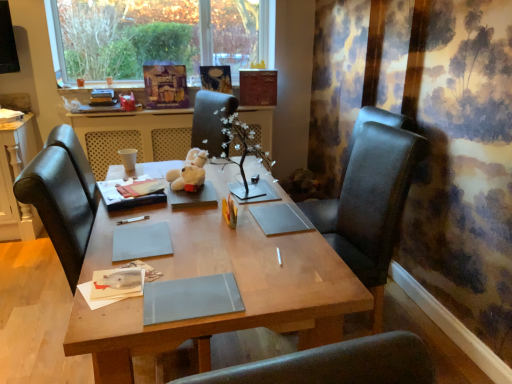
Where is `free spot in front of matte paper book at center`? free spot in front of matte paper book at center is located at coordinates (134, 211).